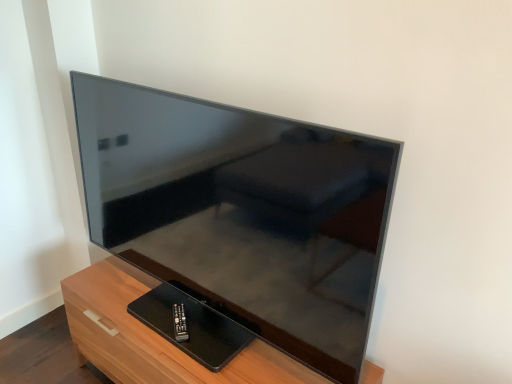
In order to click on black plastic remote at lower center in this screenshot , I will do `click(180, 323)`.

Locate an element on the screen. black plastic remote at lower center is located at coordinates (180, 323).

Is black plastic remote at lower center at the back of matte black tv at center?

No, matte black tv at center is not facing away from black plastic remote at lower center.

Which is farther, (336, 176) or (179, 331)?

Point (179, 331)

Is matte black tv at center next to black plastic remote at lower center?

No, matte black tv at center is not making contact with black plastic remote at lower center.

Considering the sizes of objects matte black tv at center and black plastic remote at lower center in the image provided, who is bigger, matte black tv at center or black plastic remote at lower center?

With larger size is matte black tv at center.

How different are the orientations of wooden tv stand at lower left and black plastic remote at lower center in degrees?

The angle between the facing direction of wooden tv stand at lower left and the facing direction of black plastic remote at lower center is 53.5 degrees.

Considering the positions of objects wooden tv stand at lower left and black plastic remote at lower center in the image provided, who is more to the right, wooden tv stand at lower left or black plastic remote at lower center?

From the viewer's perspective, wooden tv stand at lower left appears more on the right side.

Is wooden tv stand at lower left looking in the opposite direction of black plastic remote at lower center?

wooden tv stand at lower left is not turned away from black plastic remote at lower center.

From the image's perspective, who appears lower, wooden tv stand at lower left or black plastic remote at lower center?

wooden tv stand at lower left appears lower in the image.

Which of these two, black plastic remote at lower center or wooden tv stand at lower left, is thinner?

black plastic remote at lower center is thinner.

Consider the image. From the image's perspective, is black plastic remote at lower center above or below wooden tv stand at lower left?

black plastic remote at lower center is above wooden tv stand at lower left.

Considering the sizes of objects black plastic remote at lower center and wooden tv stand at lower left in the image provided, who is bigger, black plastic remote at lower center or wooden tv stand at lower left?

wooden tv stand at lower left is bigger.

Would you say wooden tv stand at lower left contains matte black tv at center?

No, matte black tv at center is not inside wooden tv stand at lower left.

From a real-world perspective, which is physically below, wooden tv stand at lower left or matte black tv at center?

wooden tv stand at lower left.

Does wooden tv stand at lower left have a greater height compared to matte black tv at center?

In fact, wooden tv stand at lower left may be shorter than matte black tv at center.

Between wooden tv stand at lower left and matte black tv at center, which one has smaller size?

With smaller size is wooden tv stand at lower left.

In the scene shown: Is black plastic remote at lower center wider than matte black tv at center?

Incorrect, the width of black plastic remote at lower center does not surpass that of matte black tv at center.

Looking at this image, is black plastic remote at lower center smaller than matte black tv at center?

Yes, black plastic remote at lower center is smaller than matte black tv at center.

Is point (180, 318) closer or farther from the camera than point (194, 267)?

Clearly, point (180, 318) is more distant from the camera than point (194, 267).

Where is `control located on the left of matte black tv at center`? This screenshot has width=512, height=384. control located on the left of matte black tv at center is located at coordinates (180, 323).

Considering the relative sizes of matte black tv at center and wooden tv stand at lower left in the image provided, is matte black tv at center thinner than wooden tv stand at lower left?

Yes, matte black tv at center is thinner than wooden tv stand at lower left.

Considering the sizes of objects matte black tv at center and wooden tv stand at lower left in the image provided, who is smaller, matte black tv at center or wooden tv stand at lower left?

wooden tv stand at lower left.

There is a wooden tv stand at lower left. Where is `television above it (from a real-world perspective)`? television above it (from a real-world perspective) is located at coordinates (242, 212).

From the image's perspective, would you say matte black tv at center is shown under wooden tv stand at lower left?

No, from the image's perspective, matte black tv at center is not beneath wooden tv stand at lower left.

Locate an element on the screen. control that appears on the left of matte black tv at center is located at coordinates (180, 323).

This screenshot has width=512, height=384. In the image, there is a black plastic remote at lower center. In order to click on furniture below it (from a real-world perspective) in this screenshot , I will do `click(154, 336)`.

Considering their positions, is matte black tv at center positioned further to black plastic remote at lower center than wooden tv stand at lower left?

matte black tv at center lies further to black plastic remote at lower center than the other object.

From the image, which object appears to be farther from wooden tv stand at lower left, black plastic remote at lower center or matte black tv at center?

Based on the image, matte black tv at center appears to be further to wooden tv stand at lower left.

From the image, which object appears to be nearer to matte black tv at center, black plastic remote at lower center or wooden tv stand at lower left?

wooden tv stand at lower left.

Considering their positions, is matte black tv at center positioned closer to wooden tv stand at lower left than black plastic remote at lower center?

black plastic remote at lower center lies closer to wooden tv stand at lower left than the other object.

Based on their spatial positions, is wooden tv stand at lower left or matte black tv at center closer to black plastic remote at lower center?

Based on the image, wooden tv stand at lower left appears to be nearer to black plastic remote at lower center.

Which object lies nearer to the anchor point matte black tv at center, wooden tv stand at lower left or black plastic remote at lower center?

wooden tv stand at lower left.

Find the location of a particular element. The image size is (512, 384). furniture positioned between matte black tv at center and black plastic remote at lower center from near to far is located at coordinates (154, 336).